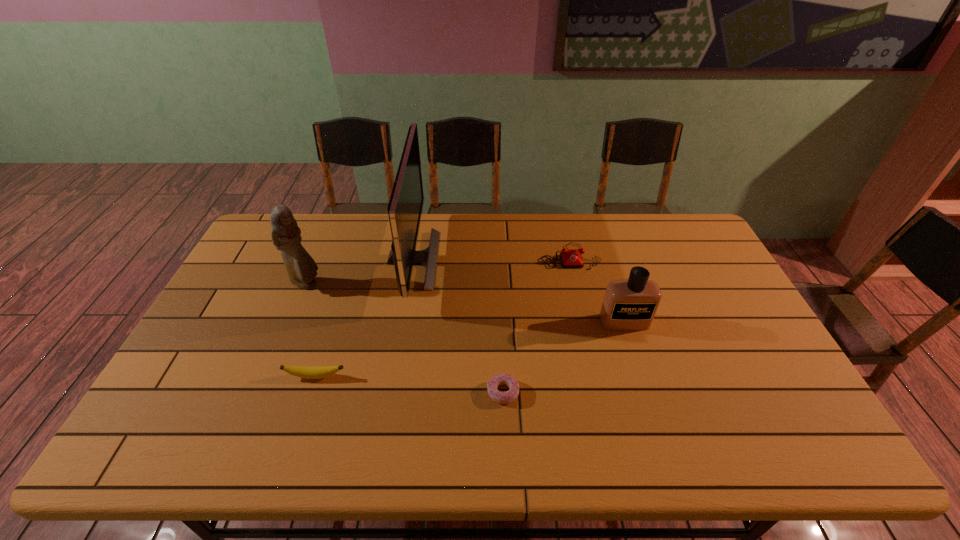
Where is `the third object from left to right`? the third object from left to right is located at coordinates (405, 207).

The image size is (960, 540). Find the location of `monitor`. monitor is located at coordinates (405, 207).

This screenshot has width=960, height=540. I want to click on figurine, so (285, 233).

Identify the location of the third tallest object. The height and width of the screenshot is (540, 960). (630, 304).

At what (x,y) coordinates should I click in order to perform the action: click on telephone. Please return your answer as a coordinate pair (x, y). The image size is (960, 540). Looking at the image, I should click on (570, 258).

I want to click on the second shortest object, so click(308, 372).

Locate an element on the screen. doughnut is located at coordinates (509, 396).

The width and height of the screenshot is (960, 540). In order to click on the third object from right to left in this screenshot , I will do `click(509, 396)`.

Where is `free region located 0.350m on the screen side of the fourth object from right to left`? Image resolution: width=960 pixels, height=540 pixels. free region located 0.350m on the screen side of the fourth object from right to left is located at coordinates (540, 260).

Locate an element on the screen. free space located 0.300m on the front-facing side of the figurine is located at coordinates pos(416,284).